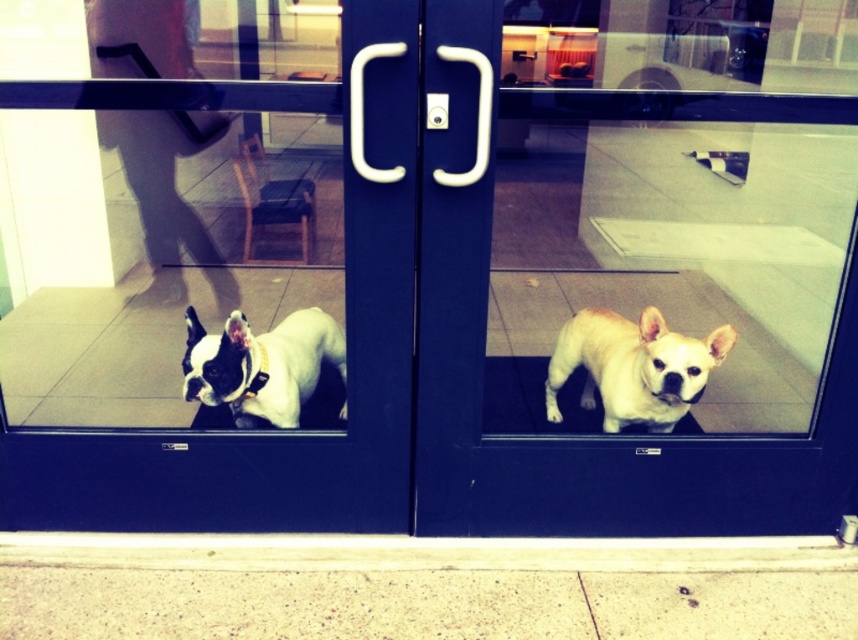
Is point (551, 508) more distant than point (403, 218)?

Yes.

Does white glossy dog at center lie in front of white glossy screen door at left?

→ Yes, it is in front of white glossy screen door at left.

Between point (704, 497) and point (396, 378), which one is positioned in front?

Point (396, 378)

Where is `white glossy dog at center`? This screenshot has height=640, width=858. white glossy dog at center is located at coordinates (591, 440).

Does white glossy screen door at left come in front of white leather dog at left?

Yes.

Which is in front, point (31, 456) or point (186, 61)?

Point (31, 456) is more forward.

Find the location of `white glossy screen door at left`. white glossy screen door at left is located at coordinates (273, 435).

What do you see at coordinates (591, 440) in the screenshot?
I see `white glossy dog at center` at bounding box center [591, 440].

Looking at this image, does white glossy dog at center have a lesser height compared to light beige fur at center?

No.

The image size is (858, 640). I want to click on white glossy dog at center, so click(x=591, y=440).